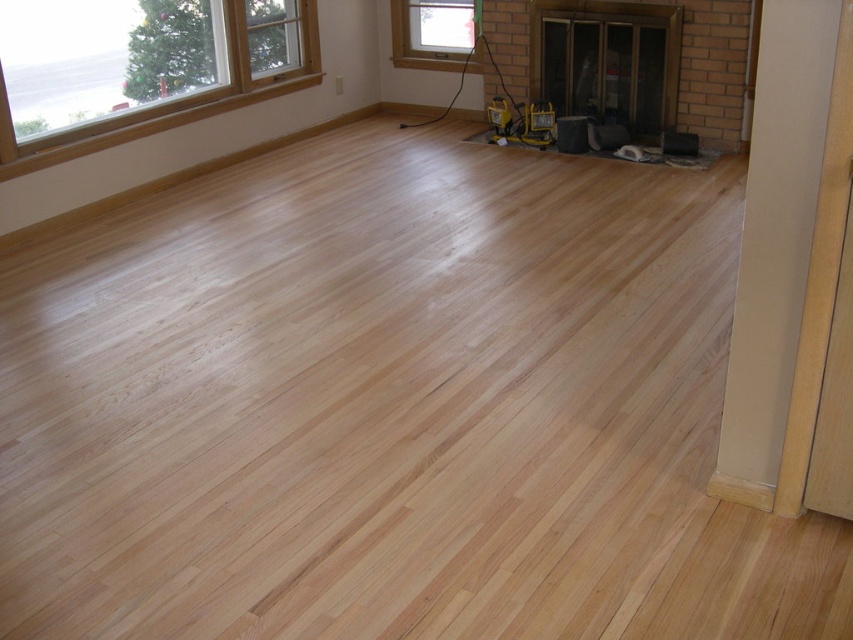
Does point (106, 144) lie behind point (537, 116)?

No, it is not.

Does clear glass window at upper left have a greater height compared to yellow plastic tool at center?

Yes, clear glass window at upper left is taller than yellow plastic tool at center.

Between point (161, 113) and point (497, 136), which one is positioned behind?

Positioned behind is point (497, 136).

At what (x,y) coordinates should I click in order to perform the action: click on clear glass window at upper left. Please return your answer as a coordinate pair (x, y). The width and height of the screenshot is (853, 640). Looking at the image, I should click on (170, 100).

Is natural wood floor at center taller than clear glass window at upper left?

Yes.

Is point (242, 460) positioned after point (160, 115)?

No, (242, 460) is closer to viewer.

Where is `natural wood floor at center`? natural wood floor at center is located at coordinates click(x=364, y=396).

Is natural wood floor at center closer to camera compared to yellow plastic tool at center?

Yes.

Is natural wood floor at center to the left of yellow plastic tool at center from the viewer's perspective?

Yes, natural wood floor at center is to the left of yellow plastic tool at center.

Which is behind, point (35, 477) or point (515, 132)?

Point (515, 132)

Where is `natural wood floor at center`? The image size is (853, 640). natural wood floor at center is located at coordinates (364, 396).